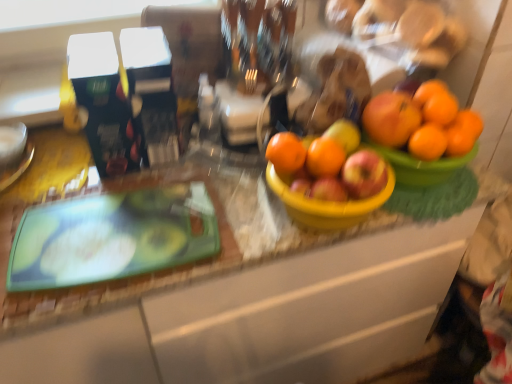
Question: Considering the relative positions of orange matte at upper right, arranged as the third orange when viewed from the left, and orange matte at center, which appears as the fourth orange when viewed from the right, in the image provided, is orange matte at upper right, arranged as the third orange when viewed from the left, behind orange matte at center, which appears as the fourth orange when viewed from the right,?

Choices:
 (A) no
 (B) yes

Answer: (B)

Question: Considering the relative sizes of orange matte at upper right, which is counted as the second orange, starting from the right, and orange matte at center, which appears as the fourth orange when viewed from the right, in the image provided, is orange matte at upper right, which is counted as the second orange, starting from the right, shorter than orange matte at center, which appears as the fourth orange when viewed from the right,?

Choices:
 (A) no
 (B) yes

Answer: (A)

Question: Is orange matte at upper right, which is counted as the second orange, starting from the right, wider than orange matte at center, which is counted as the 1th orange, starting from the left?

Choices:
 (A) yes
 (B) no

Answer: (A)

Question: Could orange matte at center, which is counted as the 1th orange, starting from the left, be considered to be inside orange matte at upper right, arranged as the third orange when viewed from the left?

Choices:
 (A) yes
 (B) no

Answer: (B)

Question: Does orange matte at upper right, which is counted as the second orange, starting from the right, have a smaller size compared to orange matte at center, which is counted as the 1th orange, starting from the left?

Choices:
 (A) yes
 (B) no

Answer: (B)

Question: Is orange matte at upper right, which is counted as the second orange, starting from the right, looking in the opposite direction of orange matte at center, which is counted as the 1th orange, starting from the left?

Choices:
 (A) yes
 (B) no

Answer: (B)

Question: From the image's perspective, would you say orange matte at right, acting as the fourth orange starting from the left, is positioned over orange matte at upper right, which is counted as the second orange, starting from the right?

Choices:
 (A) yes
 (B) no

Answer: (B)

Question: From the image's perspective, is orange matte at right, which is the 1th orange in right-to-left order, beneath orange matte at upper right, which is counted as the second orange, starting from the right?

Choices:
 (A) no
 (B) yes

Answer: (B)

Question: Is orange matte at upper right, which is counted as the second orange, starting from the right, completely or partially inside orange matte at right, acting as the fourth orange starting from the left?

Choices:
 (A) no
 (B) yes

Answer: (A)

Question: Can we say orange matte at right, acting as the fourth orange starting from the left, lies outside orange matte at upper right, arranged as the third orange when viewed from the left?

Choices:
 (A) yes
 (B) no

Answer: (A)

Question: Is orange matte at right, acting as the fourth orange starting from the left, shorter than orange matte at upper right, arranged as the third orange when viewed from the left?

Choices:
 (A) no
 (B) yes

Answer: (B)

Question: Is orange matte at upper right, which is counted as the second orange, starting from the right, at the back of orange matte at right, which is the 1th orange in right-to-left order?

Choices:
 (A) no
 (B) yes

Answer: (B)

Question: Is orange matte at right, acting as the fourth orange starting from the left, facing away from red matte apple at center?

Choices:
 (A) no
 (B) yes

Answer: (A)